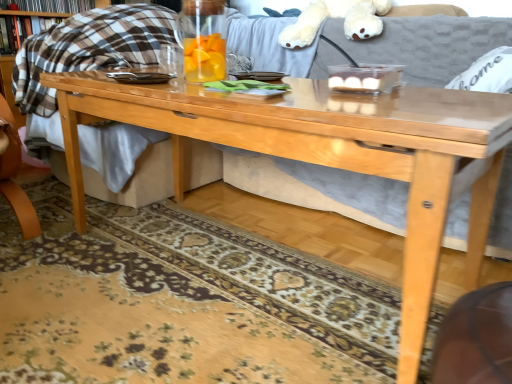
Question: Is hardcover book at upper left, which ranks as the 2th book in bottom-to-top order, positioned with its back to plaid fabric book at upper left, marked as the 1th book in a bottom-to-top arrangement?

Choices:
 (A) yes
 (B) no

Answer: (B)

Question: Considering the relative sizes of hardcover book at upper left, marked as the first book in a top-to-bottom arrangement, and plaid fabric book at upper left, marked as the 1th book in a bottom-to-top arrangement, in the image provided, is hardcover book at upper left, marked as the first book in a top-to-bottom arrangement, thinner than plaid fabric book at upper left, marked as the 1th book in a bottom-to-top arrangement,?

Choices:
 (A) no
 (B) yes

Answer: (B)

Question: Is the position of hardcover book at upper left, marked as the first book in a top-to-bottom arrangement, more distant than that of plaid fabric book at upper left, the second book from the top?

Choices:
 (A) yes
 (B) no

Answer: (A)

Question: Considering the relative sizes of hardcover book at upper left, which ranks as the 2th book in bottom-to-top order, and plaid fabric book at upper left, the second book from the top, in the image provided, is hardcover book at upper left, which ranks as the 2th book in bottom-to-top order, bigger than plaid fabric book at upper left, the second book from the top,?

Choices:
 (A) no
 (B) yes

Answer: (A)

Question: Is hardcover book at upper left, marked as the first book in a top-to-bottom arrangement, far from plaid fabric book at upper left, marked as the 1th book in a bottom-to-top arrangement?

Choices:
 (A) yes
 (B) no

Answer: (B)

Question: Does hardcover book at upper left, which ranks as the 2th book in bottom-to-top order, have a greater height compared to plaid fabric book at upper left, marked as the 1th book in a bottom-to-top arrangement?

Choices:
 (A) no
 (B) yes

Answer: (A)

Question: Is transparent glass pitcher at center positioned behind white plush bear at upper center?

Choices:
 (A) no
 (B) yes

Answer: (A)

Question: Is transparent glass pitcher at center outside white plush bear at upper center?

Choices:
 (A) yes
 (B) no

Answer: (A)

Question: Does transparent glass pitcher at center have a lesser height compared to white plush bear at upper center?

Choices:
 (A) yes
 (B) no

Answer: (A)

Question: From the image's perspective, is transparent glass pitcher at center below white plush bear at upper center?

Choices:
 (A) no
 (B) yes

Answer: (B)

Question: Considering the relative positions of transparent glass pitcher at center and white plush bear at upper center in the image provided, is transparent glass pitcher at center to the left of white plush bear at upper center from the viewer's perspective?

Choices:
 (A) no
 (B) yes

Answer: (B)

Question: Would you say transparent glass pitcher at center contains white plush bear at upper center?

Choices:
 (A) yes
 (B) no

Answer: (B)

Question: Are plaid fabric book at upper left, marked as the 1th book in a bottom-to-top arrangement, and transparent glass pitcher at center located far from each other?

Choices:
 (A) yes
 (B) no

Answer: (A)